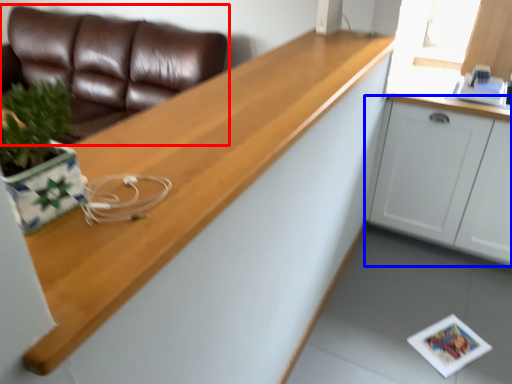
Question: Among these objects, which one is nearest to the camera, studio couch (highlighted by a red box) or cabinetry (highlighted by a blue box)?

Choices:
 (A) studio couch
 (B) cabinetry

Answer: (B)